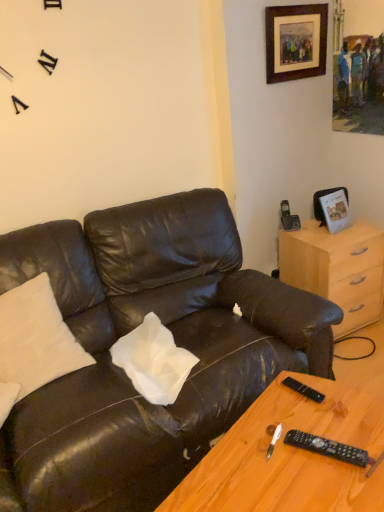
Locate an element on the screen. free location in front of metallic silver photo frame at upper right, the first picture frame positioned from the bottom is located at coordinates (346, 241).